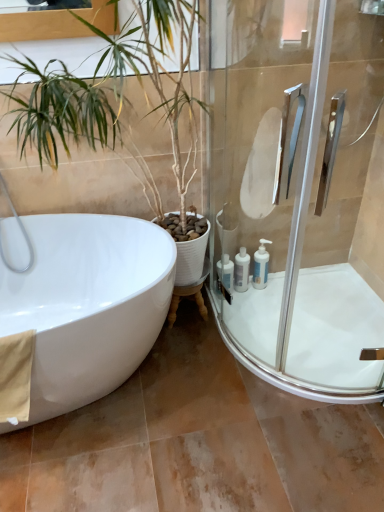
Locate an element on the screen. Image resolution: width=384 pixels, height=512 pixels. vacant space to the right of white plastic bottles at lower right, positioned as the 1th toiletry in left-to-right order is located at coordinates (258, 305).